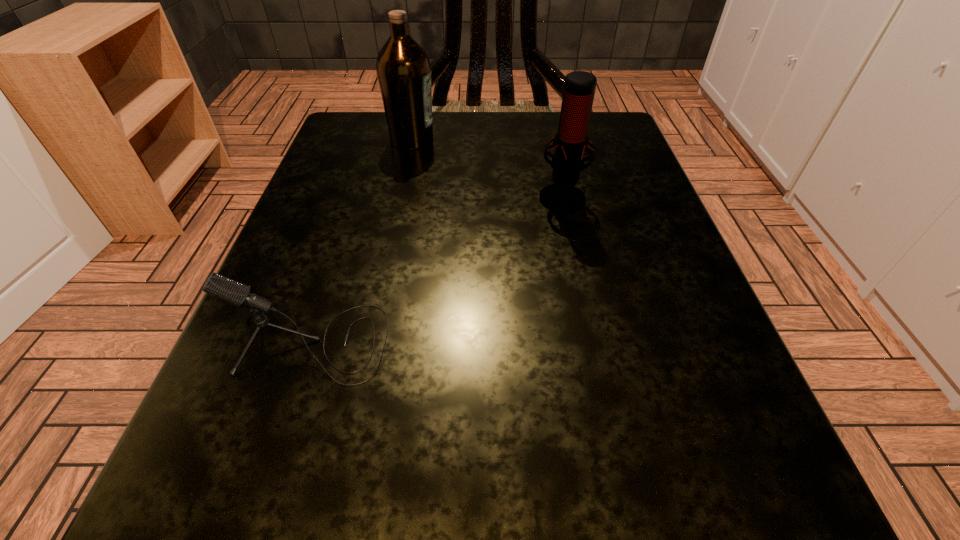
In order to click on olive oil in this screenshot , I will do `click(403, 68)`.

Where is `the taller microphone`? The image size is (960, 540). the taller microphone is located at coordinates (571, 140).

I want to click on the right microphone, so [x=571, y=140].

Locate an element on the screen. The width and height of the screenshot is (960, 540). the left microphone is located at coordinates point(231,291).

At what (x,y) coordinates should I click in order to perform the action: click on the nearer microphone. Please return your answer as a coordinate pair (x, y). Image resolution: width=960 pixels, height=540 pixels. Looking at the image, I should click on (231, 291).

I want to click on free space located on the label of the farthest object, so click(603, 139).

You are a GUI agent. You are given a task and a screenshot of the screen. Output one action in this format:
    pyautogui.click(x=<x>, y=<y>)
    Task: Click on the free location located on the back of the rightmost object
    The width and height of the screenshot is (960, 540).
    Given the screenshot: What is the action you would take?
    pyautogui.click(x=547, y=127)

The height and width of the screenshot is (540, 960). Identify the location of vacant point located on the stand of the nearest object. (518, 343).

The width and height of the screenshot is (960, 540). Identify the location of object that is at the far edge. (403, 68).

I want to click on olive oil positioned at the left edge, so click(403, 68).